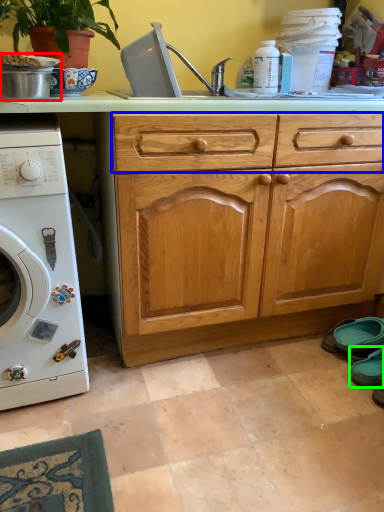
Question: Which object is positioned closest to appliance (highlighted by a red box)? Select from drawer (highlighted by a blue box) and shoe (highlighted by a green box).

Choices:
 (A) drawer
 (B) shoe

Answer: (A)